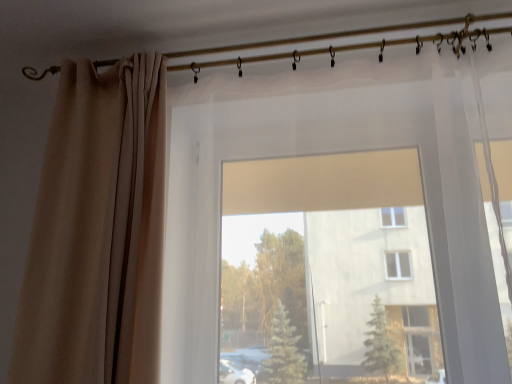
Question: From the image's perspective, would you say beige fabric curtain at left is shown under metallic curtain rod at upper center?

Choices:
 (A) yes
 (B) no

Answer: (A)

Question: Is beige fabric curtain at left beside metallic curtain rod at upper center?

Choices:
 (A) no
 (B) yes

Answer: (A)

Question: Is beige fabric curtain at left located outside metallic curtain rod at upper center?

Choices:
 (A) no
 (B) yes

Answer: (B)

Question: Considering the relative positions of beige fabric curtain at left and metallic curtain rod at upper center in the image provided, is beige fabric curtain at left to the left of metallic curtain rod at upper center from the viewer's perspective?

Choices:
 (A) yes
 (B) no

Answer: (A)

Question: Considering the relative sizes of beige fabric curtain at left and metallic curtain rod at upper center in the image provided, is beige fabric curtain at left shorter than metallic curtain rod at upper center?

Choices:
 (A) no
 (B) yes

Answer: (A)

Question: Is beige fabric curtain at left bigger than metallic curtain rod at upper center?

Choices:
 (A) no
 (B) yes

Answer: (B)

Question: Is metallic curtain rod at upper center turned away from beige fabric curtain at left?

Choices:
 (A) no
 (B) yes

Answer: (A)

Question: Considering the relative sizes of metallic curtain rod at upper center and beige fabric curtain at left in the image provided, is metallic curtain rod at upper center bigger than beige fabric curtain at left?

Choices:
 (A) no
 (B) yes

Answer: (A)

Question: Does metallic curtain rod at upper center come behind beige fabric curtain at left?

Choices:
 (A) yes
 (B) no

Answer: (A)

Question: Does metallic curtain rod at upper center turn towards beige fabric curtain at left?

Choices:
 (A) yes
 (B) no

Answer: (B)

Question: Does metallic curtain rod at upper center have a lesser width compared to beige fabric curtain at left?

Choices:
 (A) no
 (B) yes

Answer: (B)

Question: Can you confirm if metallic curtain rod at upper center is taller than beige fabric curtain at left?

Choices:
 (A) yes
 (B) no

Answer: (B)

Question: From a real-world perspective, is metallic curtain rod at upper center above or below beige fabric curtain at left?

Choices:
 (A) above
 (B) below

Answer: (A)